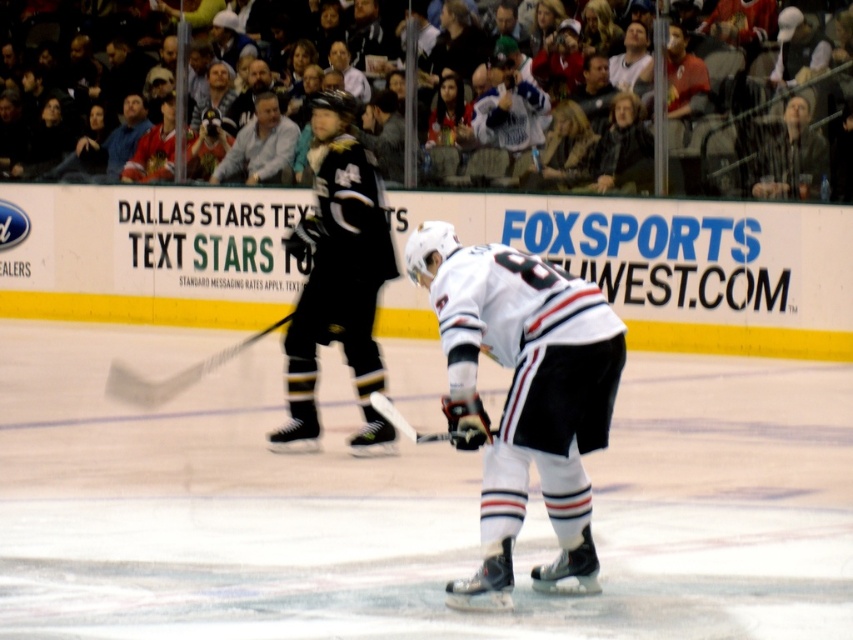
Does white matte jersey at center have a lesser width compared to black matte jersey at center?

In fact, white matte jersey at center might be wider than black matte jersey at center.

Measure the distance between white matte jersey at center and black matte jersey at center.

The distance of white matte jersey at center from black matte jersey at center is 13.15 feet.

Is point (538, 573) positioned in front of point (373, 220)?

Yes, it is.

The width and height of the screenshot is (853, 640). What are the coordinates of `white matte jersey at center` in the screenshot? It's located at (521, 396).

Consider the image. Is white matte jersey at center bigger than gray fabric shirt at upper center?

Indeed, white matte jersey at center has a larger size compared to gray fabric shirt at upper center.

What do you see at coordinates (521, 396) in the screenshot? The width and height of the screenshot is (853, 640). I see `white matte jersey at center` at bounding box center [521, 396].

Where is `white matte jersey at center`? white matte jersey at center is located at coordinates (521, 396).

Between point (305, 241) and point (271, 177), which one is positioned behind?

Point (271, 177)

Which is above, black matte jersey at center or gray fabric shirt at upper center?

gray fabric shirt at upper center is above.

Is point (375, 198) closer to camera compared to point (274, 132)?

That is True.

Where is `black matte jersey at center`? The height and width of the screenshot is (640, 853). black matte jersey at center is located at coordinates (339, 278).